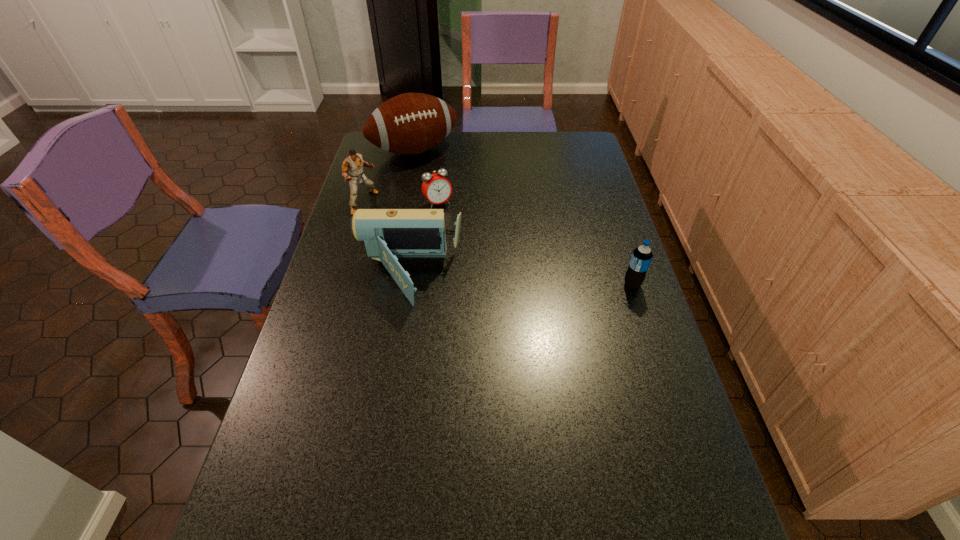
The width and height of the screenshot is (960, 540). In order to click on camcorder in this screenshot , I will do `click(388, 234)`.

You are a GUI agent. You are given a task and a screenshot of the screen. Output one action in this format:
    pyautogui.click(x=<x>, y=<y>)
    Task: Click on the soda bottle
    
    Given the screenshot: What is the action you would take?
    pyautogui.click(x=641, y=257)

At what (x,y) coordinates should I click in order to perform the action: click on puncher. Please return your answer as a coordinate pair (x, y). Image resolution: width=960 pixels, height=540 pixels. Looking at the image, I should click on (353, 163).

Identify the location of football. The image size is (960, 540). (411, 123).

Find the location of a particular element. This screenshot has height=540, width=960. the shortest object is located at coordinates (436, 188).

Find the location of a particular element. This screenshot has height=540, width=960. vacant position located on the side of the camcorder with the flip-out screen is located at coordinates (327, 277).

Find the location of `vacant position located 0.050m on the side of the camcorder with the flip-out screen`. vacant position located 0.050m on the side of the camcorder with the flip-out screen is located at coordinates (338, 277).

Locate an element on the screen. free space located on the front of the rightmost object is located at coordinates (639, 308).

Locate an element on the screen. vacant area located on the front-facing side of the puncher is located at coordinates (386, 217).

Find the location of a particular element. Image resolution: width=960 pixels, height=540 pixels. free spot located on the front-facing side of the puncher is located at coordinates (393, 220).